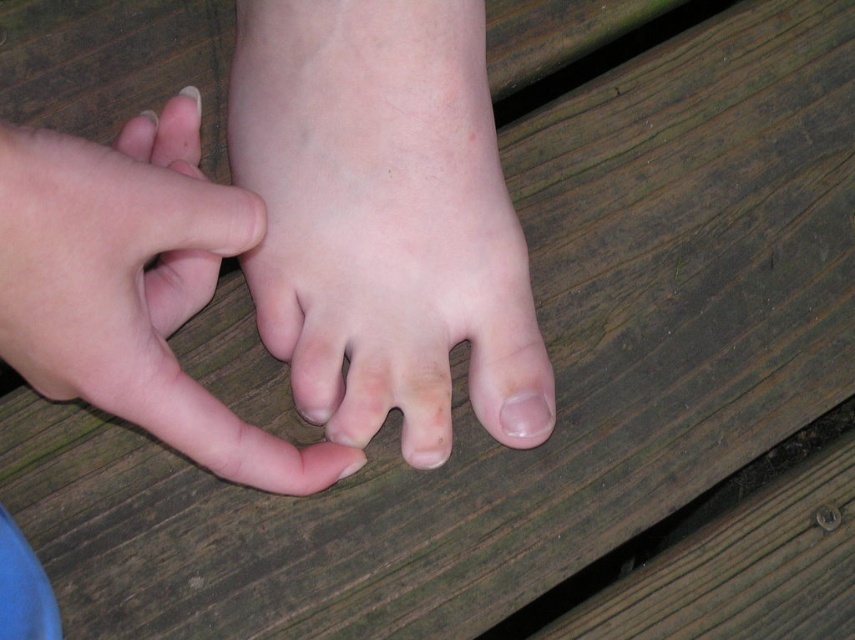
Between pale skin foot at center and smooth skin hand at center, which one has more height?

pale skin foot at center

Can you confirm if pale skin foot at center is positioned to the right of smooth skin hand at center?

Indeed, pale skin foot at center is positioned on the right side of smooth skin hand at center.

Describe the element at coordinates (380, 214) in the screenshot. I see `pale skin foot at center` at that location.

Identify the location of pale skin foot at center. (380, 214).

Where is `smooth pink nail at center`? smooth pink nail at center is located at coordinates (526, 417).

What do you see at coordinates (526, 417) in the screenshot? I see `smooth pink nail at center` at bounding box center [526, 417].

This screenshot has height=640, width=855. I want to click on smooth pink nail at center, so click(x=526, y=417).

Locate an element on the screen. Image resolution: width=855 pixels, height=640 pixels. smooth pink nail at center is located at coordinates (526, 417).

Which of these two, smooth skin hand at center or pale skin toe at center, stands shorter?

With less height is pale skin toe at center.

Is point (177, 300) behind point (196, 109)?

No, it is not.

This screenshot has height=640, width=855. Find the location of `smooth skin hand at center`. smooth skin hand at center is located at coordinates (133, 288).

You are a GUI agent. You are given a task and a screenshot of the screen. Output one action in this format:
    pyautogui.click(x=<x>, y=<y>)
    Task: Click on the smooth skin hand at center
    The width and height of the screenshot is (855, 640).
    Given the screenshot: What is the action you would take?
    pyautogui.click(x=133, y=288)